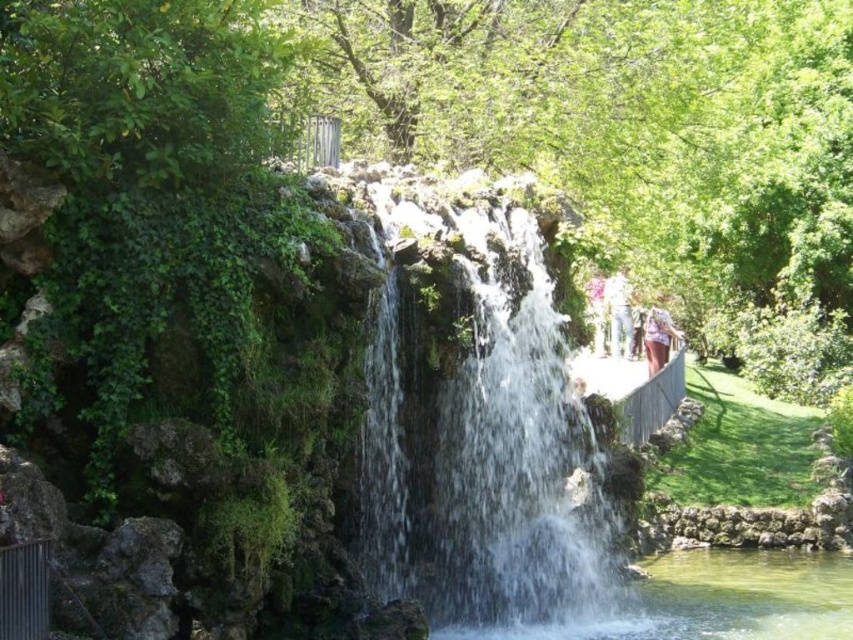
Question: Is clear water at center to the left of white fabric at right from the viewer's perspective?

Choices:
 (A) yes
 (B) no

Answer: (A)

Question: Estimate the real-world distances between objects in this image. Which object is farther from the pink fabric at center?

Choices:
 (A) light purple fabric at center-right
 (B) white fabric at right
 (C) clear water at center
 (D) clear glass pond at center

Answer: (D)

Question: Which of the following is the farthest from the observer?

Choices:
 (A) pink fabric at center
 (B) clear glass pond at center
 (C) light purple fabric at center-right
 (D) clear water at center

Answer: (C)

Question: Considering the relative positions of clear water at center and light purple fabric at center-right in the image provided, where is clear water at center located with respect to light purple fabric at center-right?

Choices:
 (A) above
 (B) below

Answer: (B)

Question: Considering the real-world distances, which object is closest to the clear glass pond at center?

Choices:
 (A) pink fabric at center
 (B) light purple fabric at center-right
 (C) white fabric at right

Answer: (A)

Question: Considering the relative positions of clear water at center and white fabric at right in the image provided, where is clear water at center located with respect to white fabric at right?

Choices:
 (A) right
 (B) left

Answer: (B)